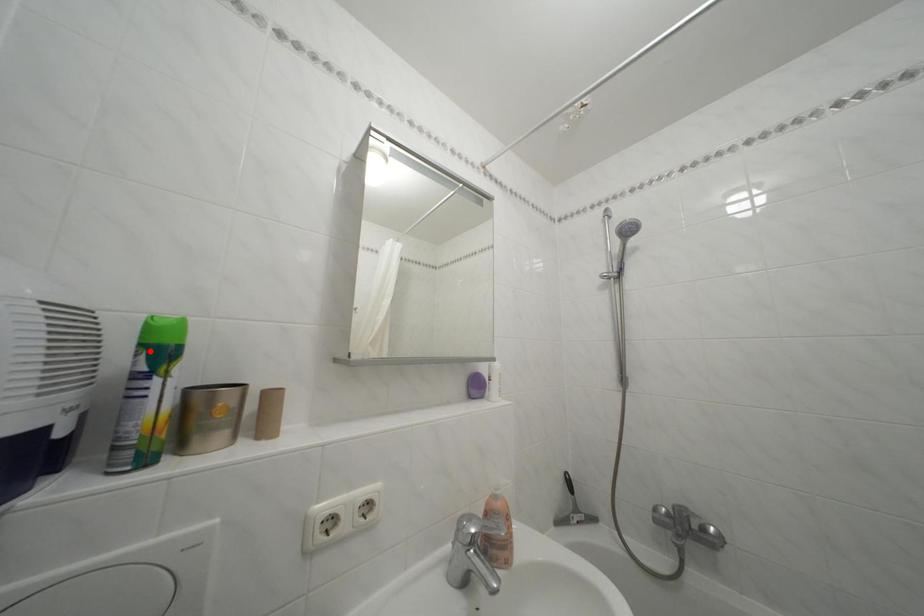
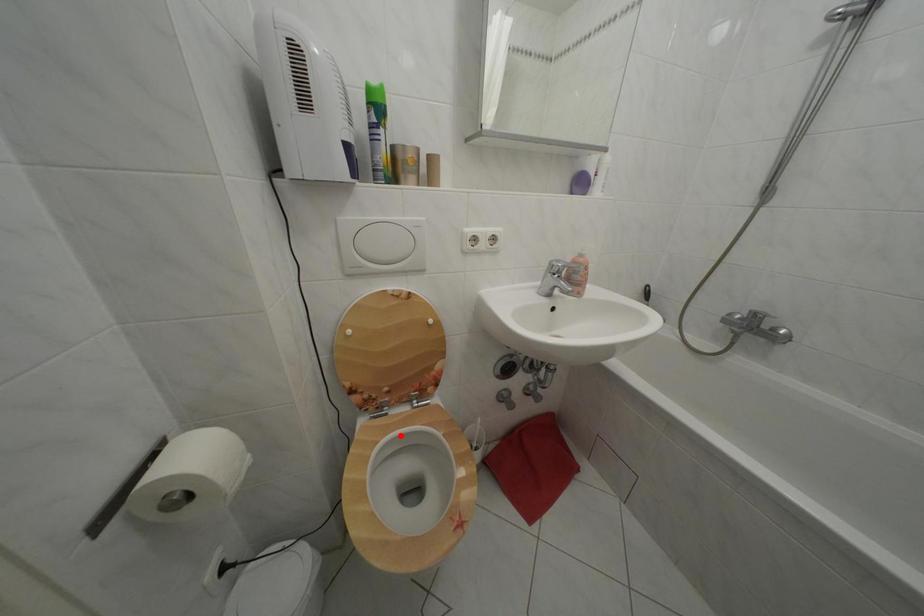
I am providing you with two images of the same scene from different viewpoints. A red point is marked on the first image and another point is marked on the second image. Does the point marked in image1 correspond to the same location as the one in image2?

No